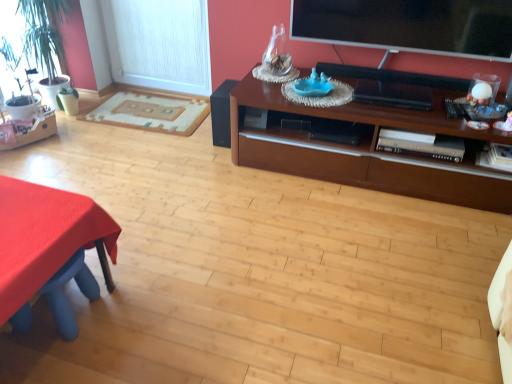
This screenshot has height=384, width=512. What are the coordinates of `free point below beige woven rug at left (from a real-world perspective)` in the screenshot? It's located at (141, 115).